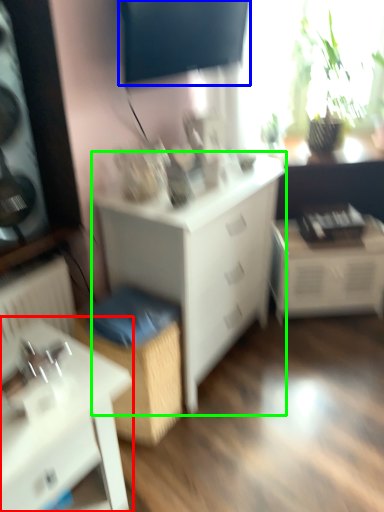
Question: Estimate the real-world distances between objects in this image. Which object is closer to table (highlighted by a red box), window screen (highlighted by a blue box) or chest of drawers (highlighted by a green box)?

Choices:
 (A) window screen
 (B) chest of drawers

Answer: (B)